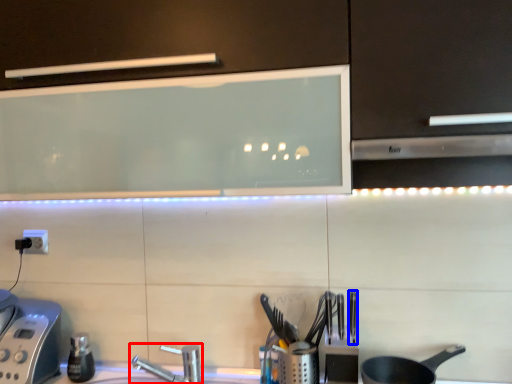
Question: Which object is closer to the camera taking this photo, tap (highlighted by a red box) or silverware (highlighted by a blue box)?

Choices:
 (A) tap
 (B) silverware

Answer: (B)